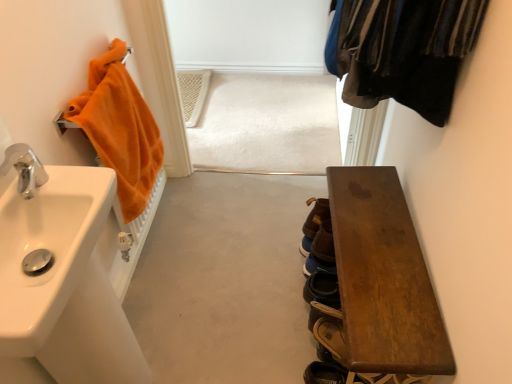
Question: Should I look upward or downward to see brown suede shoe at lower center, positioned as the 3th shoe in bottom-to-top order?

Choices:
 (A) up
 (B) down

Answer: (B)

Question: Are brown leather shoe at lower right, the third shoe viewed from the back, and brown suede shoe at lower center, the second shoe viewed from the front, located far from each other?

Choices:
 (A) no
 (B) yes

Answer: (A)

Question: Can you confirm if brown leather shoe at lower right, the 1th shoe when ordered from front to back, is thinner than brown suede shoe at lower center, which is the first shoe from top to bottom?

Choices:
 (A) no
 (B) yes

Answer: (A)

Question: Is brown leather shoe at lower right, the 1th shoe when ordered from front to back, taller than brown suede shoe at lower center, positioned as the 3th shoe in bottom-to-top order?

Choices:
 (A) yes
 (B) no

Answer: (B)

Question: From the image's perspective, is brown leather shoe at lower right, the 3th shoe when ordered from top to bottom, on top of brown suede shoe at lower center, which is the first shoe from top to bottom?

Choices:
 (A) yes
 (B) no

Answer: (B)

Question: Is brown leather shoe at lower right, the third shoe viewed from the back, outside of brown suede shoe at lower center, which is the first shoe from top to bottom?

Choices:
 (A) no
 (B) yes

Answer: (B)

Question: Does brown leather shoe at lower right, the 3th shoe when ordered from top to bottom, have a larger size compared to brown suede shoe at lower center, positioned as the 3th shoe in bottom-to-top order?

Choices:
 (A) no
 (B) yes

Answer: (B)

Question: Can you confirm if orange terry cloth towel at left is wider than silver metallic faucet at left?

Choices:
 (A) yes
 (B) no

Answer: (A)

Question: From a real-world perspective, is orange terry cloth towel at left located beneath silver metallic faucet at left?

Choices:
 (A) no
 (B) yes

Answer: (B)

Question: Can you confirm if orange terry cloth towel at left is positioned to the right of silver metallic faucet at left?

Choices:
 (A) no
 (B) yes

Answer: (B)

Question: Is orange terry cloth towel at left looking in the opposite direction of silver metallic faucet at left?

Choices:
 (A) no
 (B) yes

Answer: (A)

Question: Does orange terry cloth towel at left have a lesser width compared to silver metallic faucet at left?

Choices:
 (A) no
 (B) yes

Answer: (A)

Question: Can you confirm if orange terry cloth towel at left is taller than silver metallic faucet at left?

Choices:
 (A) no
 (B) yes

Answer: (B)

Question: Does wooden bench at lower right have a lesser width compared to orange terry cloth towel at left?

Choices:
 (A) yes
 (B) no

Answer: (B)